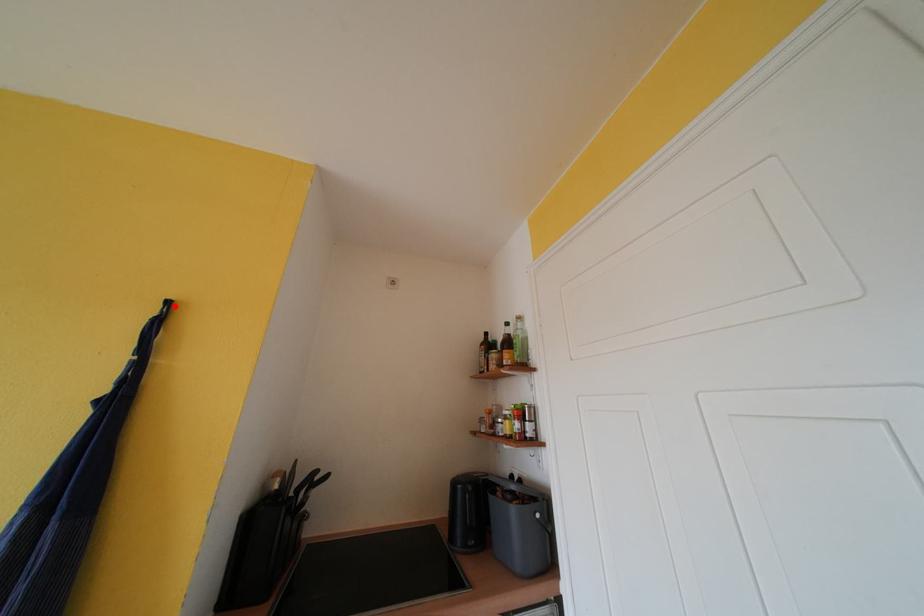
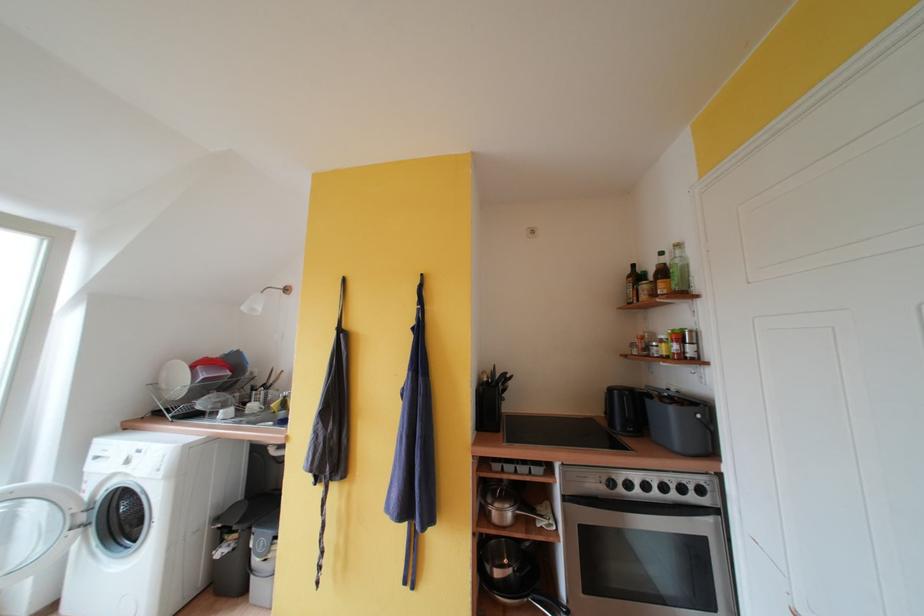
Where in the second image is the point corresponding to the highlighted location from the first image?

(428, 278)